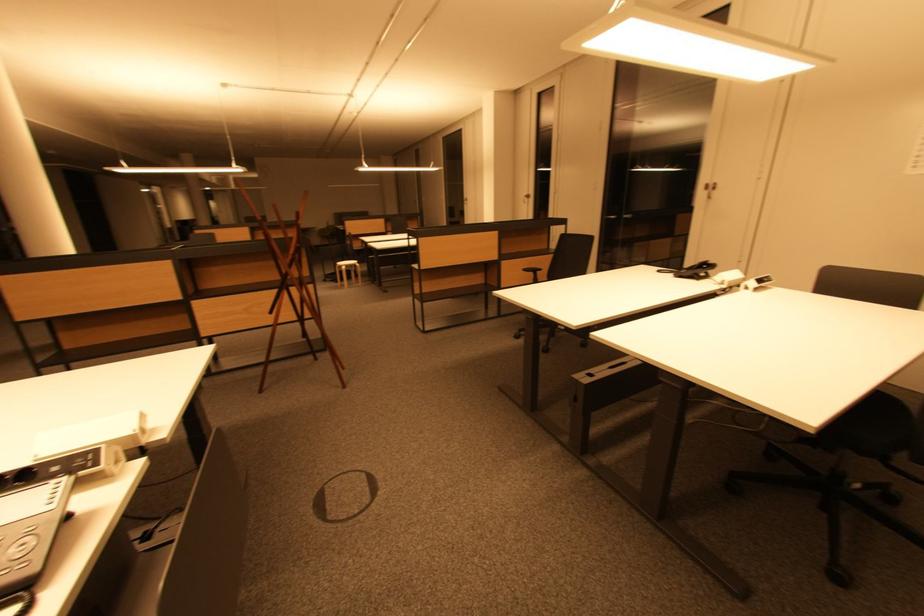
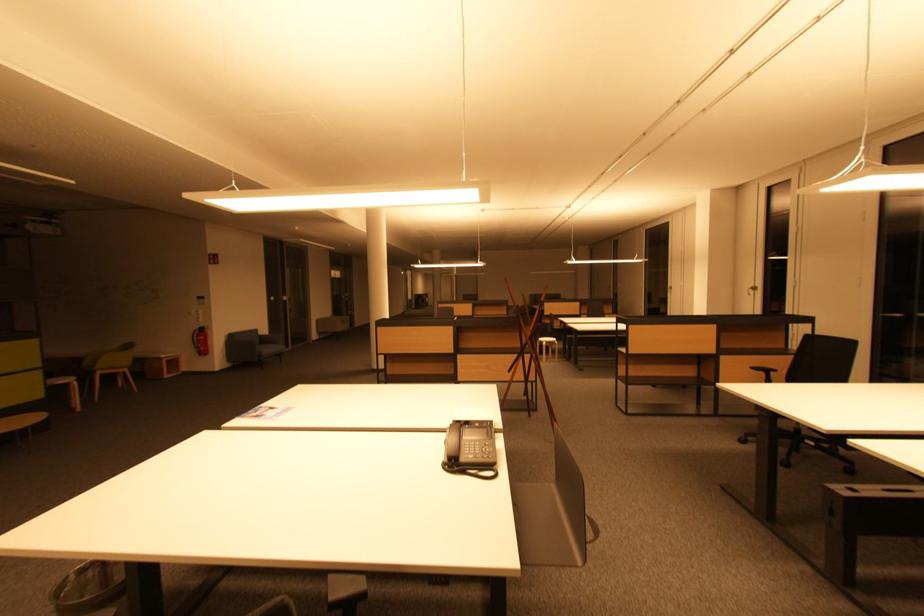
In the second image, find the point that corresponds to (535,276) in the first image.

(767, 376)